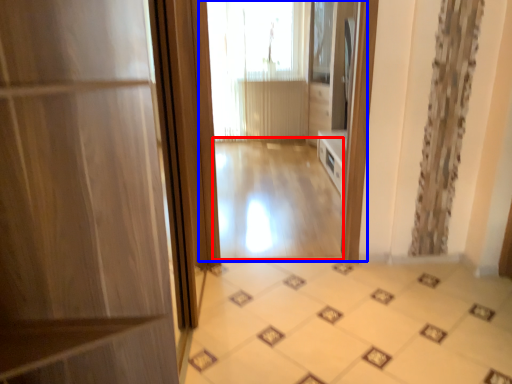
Question: Which point is closer to the camera, corridor (highlighted by a red box) or residence (highlighted by a blue box)?

Choices:
 (A) corridor
 (B) residence

Answer: (B)